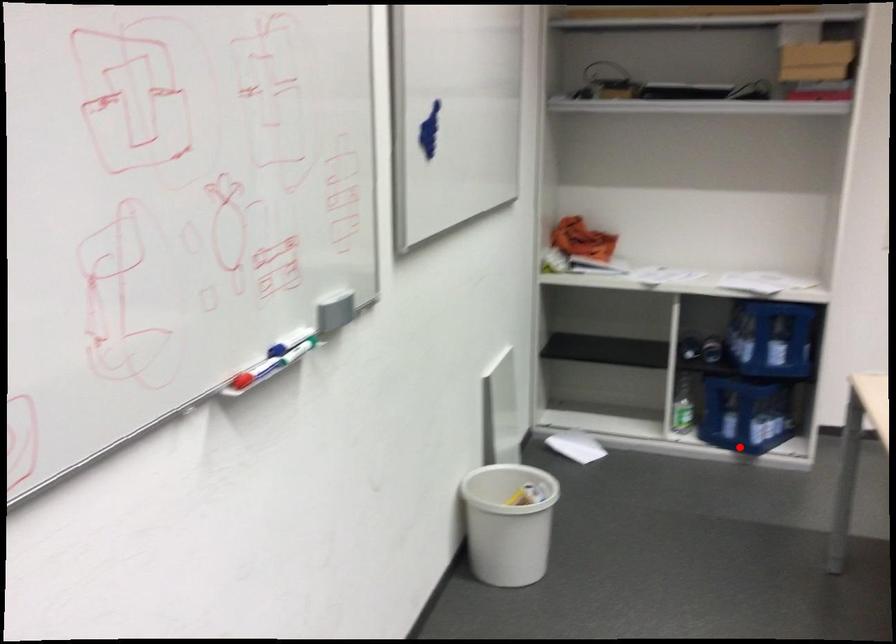
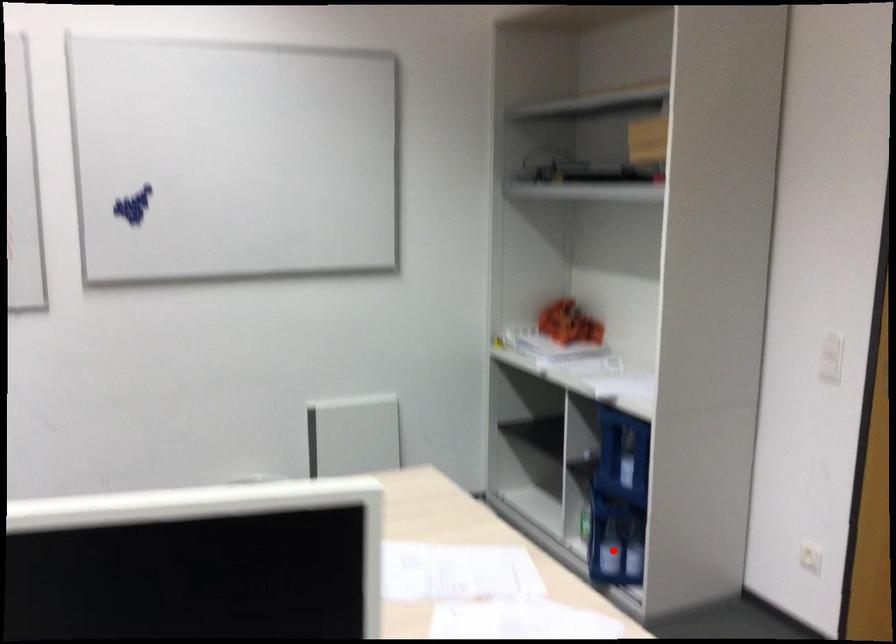
I am providing you with two images of the same scene from different viewpoints. A red point is marked on the first image and another point is marked on the second image. Is the red point in image1 aligned with the point shown in image2?

Yes